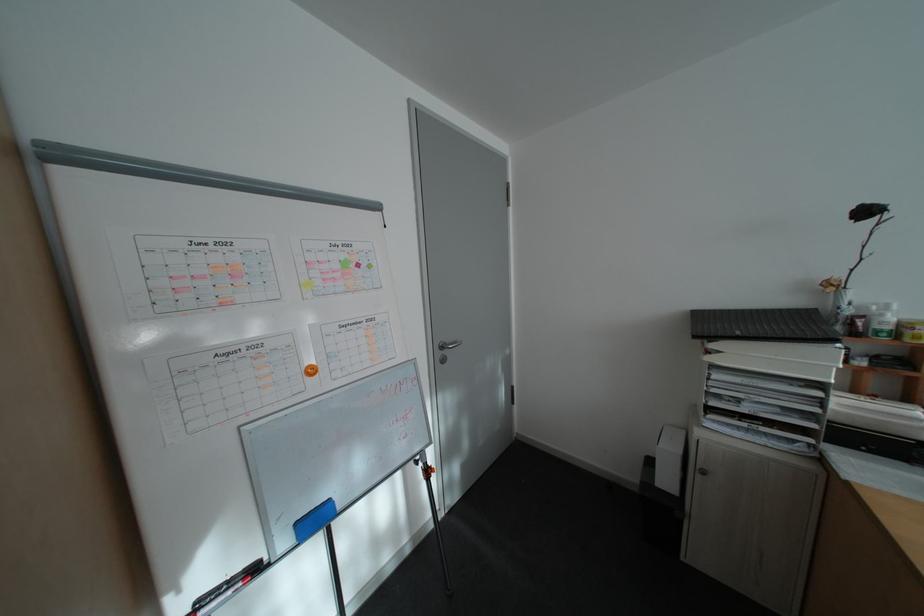
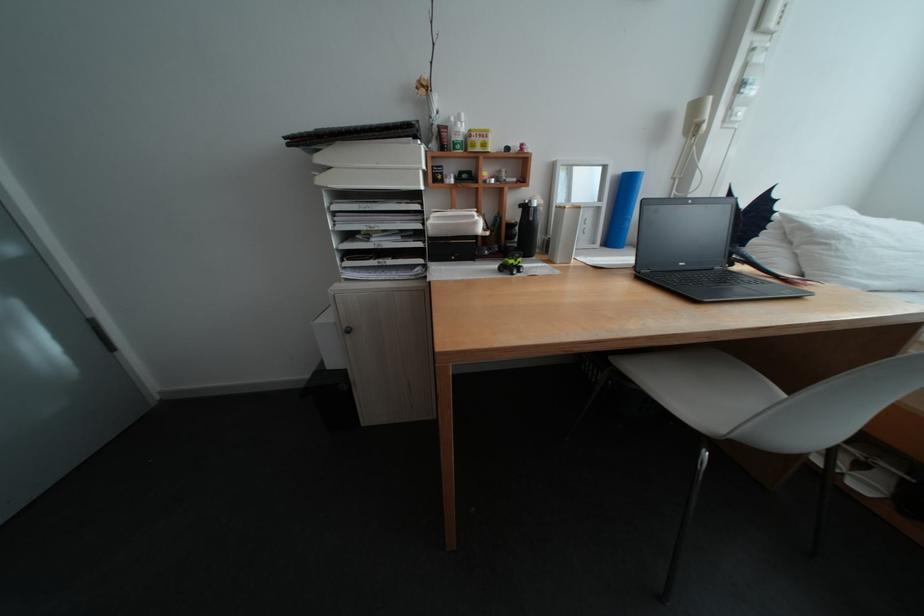
Where in the second image is the point corresponding to the point at 865,318 from the first image?

(453, 128)